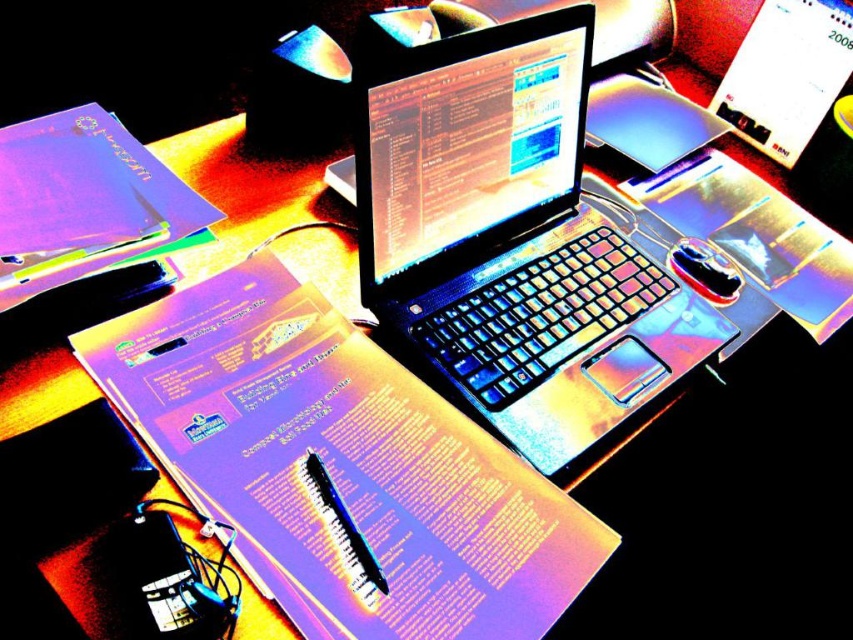
Question: Where is satin black laptop at center located in relation to metallic glossy mouse at center in the image?

Choices:
 (A) below
 (B) above

Answer: (B)

Question: Which object is closer to the camera taking this photo?

Choices:
 (A) metallic glossy mouse at center
 (B) satin black laptop at center
 (C) matte paper at center

Answer: (C)

Question: Which of these objects is positioned closest to the matte paper at center?

Choices:
 (A) satin black laptop at center
 (B) metallic glossy mouse at center

Answer: (A)

Question: Which object is positioned farthest from the metallic glossy mouse at center?

Choices:
 (A) matte paper at center
 (B) satin black laptop at center

Answer: (A)

Question: Is matte paper at center bigger than satin black laptop at center?

Choices:
 (A) yes
 (B) no

Answer: (B)

Question: Does matte paper at center appear under metallic glossy mouse at center?

Choices:
 (A) no
 (B) yes

Answer: (B)